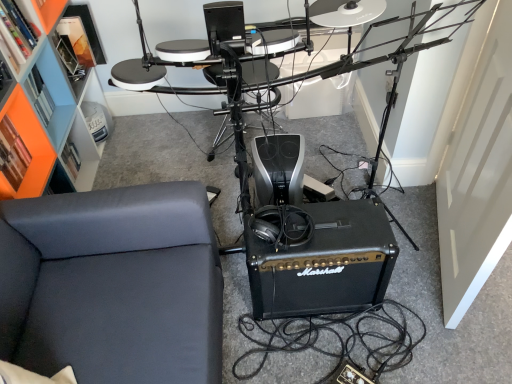
Where is `black plastic drum set at center`? black plastic drum set at center is located at coordinates (269, 62).

The image size is (512, 384). What do you see at coordinates (17, 33) in the screenshot?
I see `orange matte bookshelf at upper left` at bounding box center [17, 33].

What do you see at coordinates (53, 102) in the screenshot? I see `orange matte bookshelf at upper left` at bounding box center [53, 102].

Identify the location of black plastic drum set at center. (269, 62).

Considering the positions of objects orange matte bookshelf at upper left and black plastic drum set at center in the image provided, who is more to the left, orange matte bookshelf at upper left or black plastic drum set at center?

From the viewer's perspective, orange matte bookshelf at upper left appears more on the left side.

Does orange matte bookshelf at upper left have a lesser width compared to black plastic drum set at center?

Yes, orange matte bookshelf at upper left is thinner than black plastic drum set at center.

Between orange matte bookshelf at upper left and black plastic drum set at center, which one has less height?

Standing shorter between the two is orange matte bookshelf at upper left.

Consider the image. How many degrees apart are the facing directions of black plastic drum set at center and black leather couch at lower left?

The facing directions of black plastic drum set at center and black leather couch at lower left are 89.3 degrees apart.

Is black plastic drum set at center far from black leather couch at lower left?

That's not correct — black plastic drum set at center is a little close to black leather couch at lower left.

From a real-world perspective, does black plastic drum set at center stand above black leather couch at lower left?

Yes, from a real-world perspective, black plastic drum set at center is over black leather couch at lower left

From a real-world perspective, is orange matte bookshelf at upper left physically above black matte marshall amplifier at center?

Yes, from a real-world perspective, orange matte bookshelf at upper left is over black matte marshall amplifier at center

Is orange matte bookshelf at upper left wider or thinner than black matte marshall amplifier at center?

Considering their sizes, orange matte bookshelf at upper left looks slimmer than black matte marshall amplifier at center.

Is orange matte bookshelf at upper left far away from black matte marshall amplifier at center?

That's right, there is a large distance between orange matte bookshelf at upper left and black matte marshall amplifier at center.

Between orange matte bookshelf at upper left and black matte marshall amplifier at center, which one is positioned behind?

black matte marshall amplifier at center is further away from the camera.

Who is smaller, orange matte bookshelf at upper left or black matte marshall amplifier at center?

With smaller size is orange matte bookshelf at upper left.

From a real-world perspective, is orange matte bookshelf at upper left beneath black matte marshall amplifier at center?

No.

Based on their sizes in the image, would you say black leather couch at lower left is bigger or smaller than black plastic drum set at center?

Considering their sizes, black leather couch at lower left takes up less space than black plastic drum set at center.

Is point (72, 319) in front of point (426, 16)?

That is True.

Who is shorter, black leather couch at lower left or black plastic drum set at center?

Standing shorter between the two is black leather couch at lower left.

Can you confirm if black leather couch at lower left is wider than black plastic drum set at center?

Correct, the width of black leather couch at lower left exceeds that of black plastic drum set at center.

Is the position of black plastic drum set at center more distant than that of black matte marshall amplifier at center?

No, it is in front of black matte marshall amplifier at center.

Can black matte marshall amplifier at center be found inside black plastic drum set at center?

No.

Between black plastic drum set at center and black matte marshall amplifier at center, which one has smaller width?

black matte marshall amplifier at center.

You are a GUI agent. You are given a task and a screenshot of the screen. Output one action in this format:
    pyautogui.click(x=<x>, y=<y>)
    Task: Click on the computer desk in front of the black matte marshall amplifier at center
    The height and width of the screenshot is (384, 512).
    Given the screenshot: What is the action you would take?
    pyautogui.click(x=269, y=62)

Is orange matte bookshelf at upper left closer to camera compared to black leather couch at lower left?

No, orange matte bookshelf at upper left is further to the viewer.

From the image's perspective, is orange matte bookshelf at upper left located above or below black leather couch at lower left?

orange matte bookshelf at upper left is situated higher than black leather couch at lower left in the image.

Is orange matte bookshelf at upper left outside of black leather couch at lower left?

Absolutely, orange matte bookshelf at upper left is external to black leather couch at lower left.

Is black leather couch at lower left at the back of orange matte bookshelf at upper left?

No, orange matte bookshelf at upper left is not facing the opposite direction of black leather couch at lower left.

Locate an element on the screen. computer desk on the right of orange matte bookshelf at upper left is located at coordinates (269, 62).

Locate an element on the screen. Image resolution: width=512 pixels, height=384 pixels. computer desk behind the black leather couch at lower left is located at coordinates (269, 62).

Looking at the image, which one is located closer to black leather couch at lower left, black plastic drum set at center or black matte marshall amplifier at center?

black matte marshall amplifier at center lies closer to black leather couch at lower left than the other object.

Which object lies nearer to the anchor point black matte marshall amplifier at center, black plastic drum set at center or black leather couch at lower left?

Among the two, black plastic drum set at center is located nearer to black matte marshall amplifier at center.

Which object lies nearer to the anchor point black plastic drum set at center, black leather couch at lower left or orange matte bookshelf at upper left?

The object closer to black plastic drum set at center is black leather couch at lower left.

From the image, which object appears to be farther from orange matte bookshelf at upper left, black matte marshall amplifier at center or black leather couch at lower left?

Based on the image, black matte marshall amplifier at center appears to be further to orange matte bookshelf at upper left.

From the image, which object appears to be farther from orange matte bookshelf at upper left, black leather couch at lower left or black plastic drum set at center?

black leather couch at lower left is further to orange matte bookshelf at upper left.

When comparing their distances from black plastic drum set at center, does orange matte bookshelf at upper left or black leather couch at lower left seem closer?

black leather couch at lower left lies closer to black plastic drum set at center than the other object.

From the image, which object appears to be farther from black matte marshall amplifier at center, black plastic drum set at center or orange matte bookshelf at upper left?

orange matte bookshelf at upper left lies further to black matte marshall amplifier at center than the other object.

Looking at this image, based on their spatial positions, is black matte marshall amplifier at center or orange matte bookshelf at upper left further from black plastic drum set at center?

orange matte bookshelf at upper left is further to black plastic drum set at center.

At what (x,y) coordinates should I click in order to perform the action: click on furniture between orange matte bookshelf at upper left and black plastic drum set at center. Please return your answer as a coordinate pair (x, y). This screenshot has width=512, height=384. Looking at the image, I should click on (113, 285).

The image size is (512, 384). I want to click on furniture situated between orange matte bookshelf at upper left and black matte marshall amplifier at center from left to right, so click(x=113, y=285).

This screenshot has height=384, width=512. Find the location of `shelf between orange matte bookshelf at upper left and black plastic drum set at center from left to right`. shelf between orange matte bookshelf at upper left and black plastic drum set at center from left to right is located at coordinates (17, 33).

Identify the location of bookshelf that lies between orange matte bookshelf at upper left and black leather couch at lower left from top to bottom. This screenshot has width=512, height=384. (53, 102).